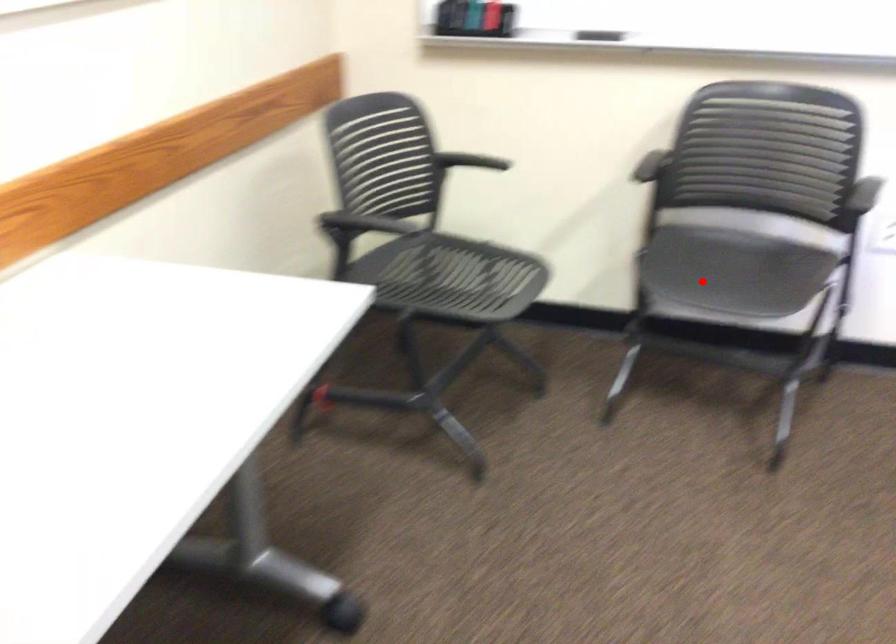
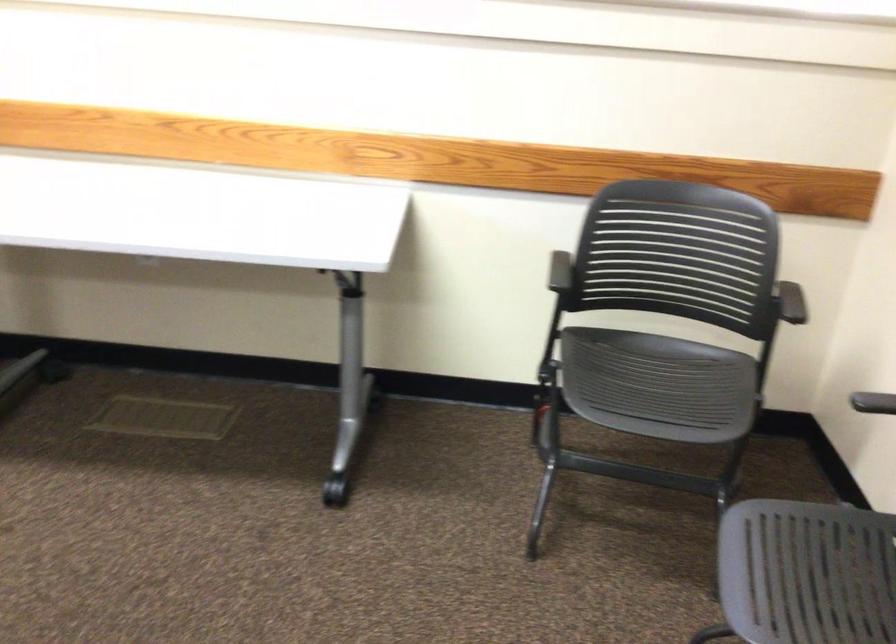
Question: I am providing you with two images of the same scene from different viewpoints. In image1, a red point is highlighted. Considering the same 3D point in image2, which of the following is correct?

Choices:
 (A) It is closer
 (B) It is farther

Answer: (A)